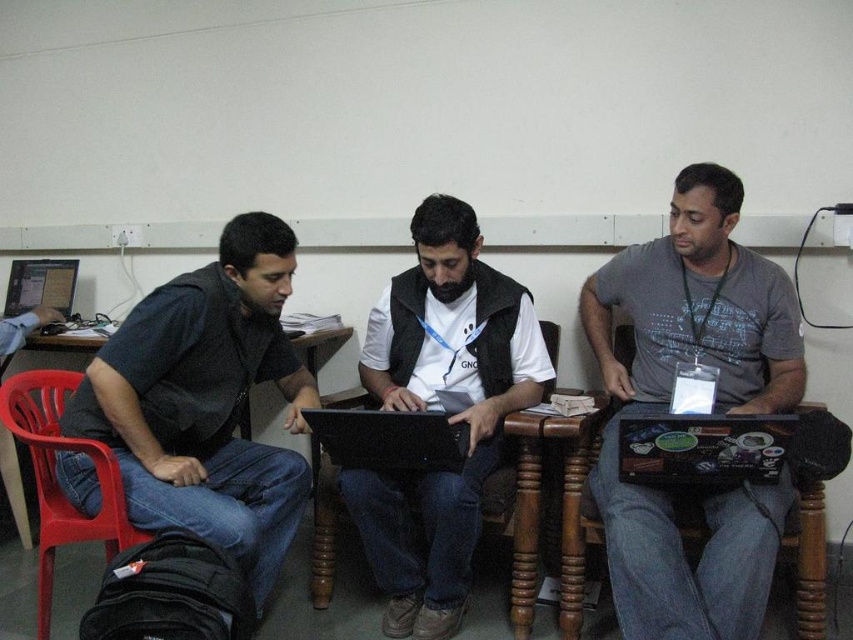
Can you confirm if matte black laptop at center is taller than black glossy laptop at center?

Correct, matte black laptop at center is much taller as black glossy laptop at center.

Identify the location of matte black laptop at center. point(440,406).

How distant is matte black laptop at center from matte black laptop at left?

They are 1.71 meters apart.

Who is shorter, matte black laptop at center or matte black laptop at left?

matte black laptop at left is shorter.

I want to click on matte black laptop at center, so click(440, 406).

Can you confirm if dark gray vest at left is positioned above black glossy laptop at center?

Yes, dark gray vest at left is above black glossy laptop at center.

Is dark gray vest at left bigger than black glossy laptop at center?

Indeed, dark gray vest at left has a larger size compared to black glossy laptop at center.

Does point (242, 339) come behind point (331, 454)?

No, it is not.

You are a GUI agent. You are given a task and a screenshot of the screen. Output one action in this format:
    pyautogui.click(x=<x>, y=<y>)
    Task: Click on the dark gray vest at left
    
    Given the screenshot: What is the action you would take?
    pyautogui.click(x=206, y=403)